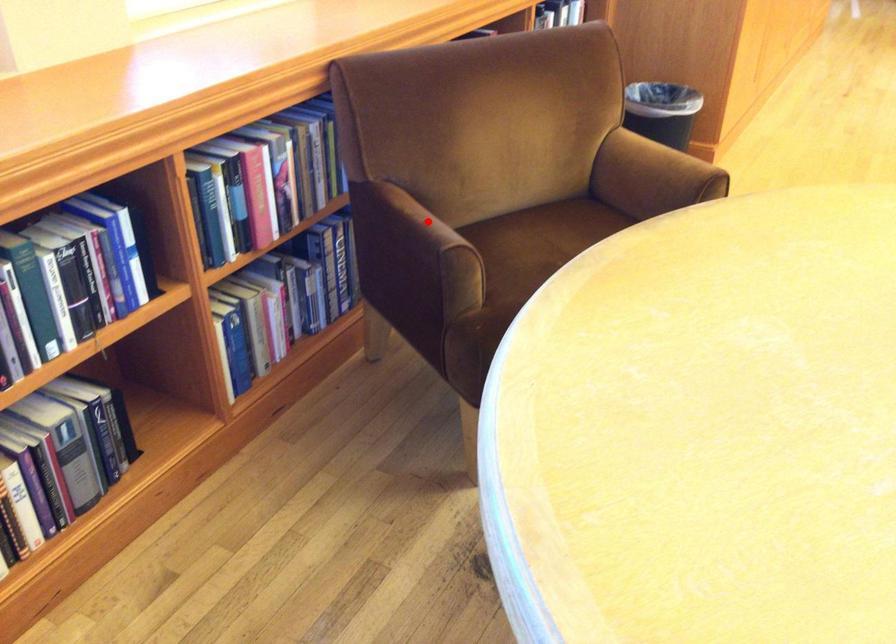
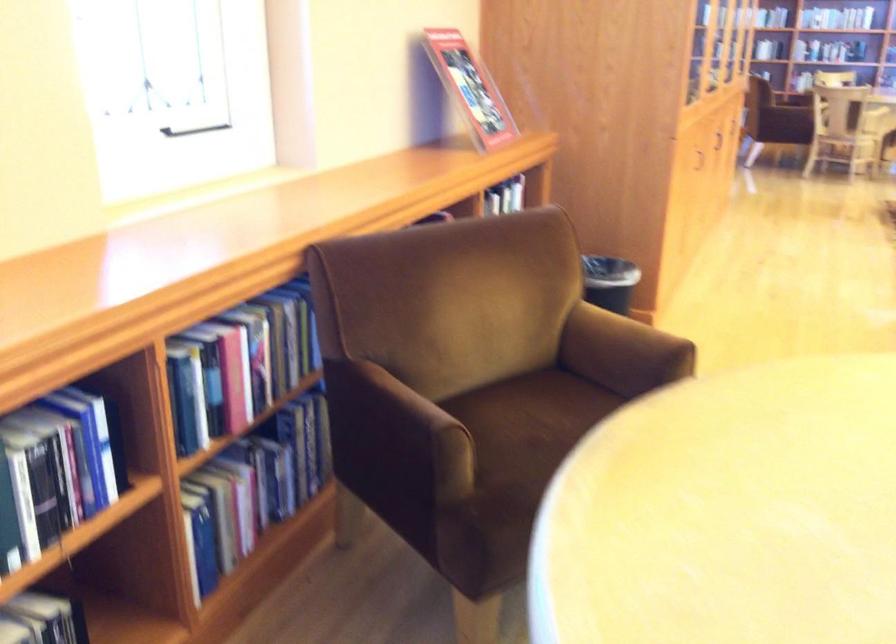
Where in the second image is the point corresponding to the highlighted location from the first image?

(414, 402)